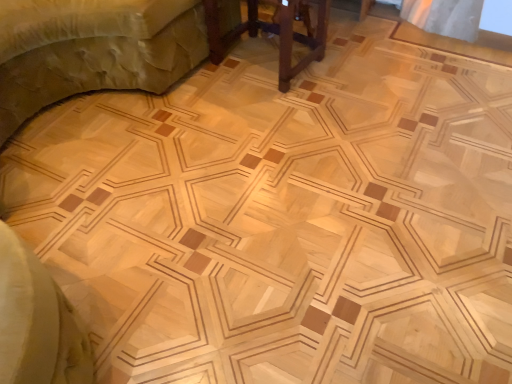
Question: In which direction should I rotate to look at brown wooden table at center, which ranks as the first furniture in right-to-left order?

Choices:
 (A) left
 (B) right

Answer: (B)

Question: Are wooden bed at upper left, arranged as the 1th furniture when viewed from the left, and brown wooden table at center, which ranks as the first furniture in right-to-left order, beside each other?

Choices:
 (A) yes
 (B) no

Answer: (B)

Question: From the image's perspective, is wooden bed at upper left, the second furniture positioned from the right, on brown wooden table at center, which ranks as the first furniture in right-to-left order?

Choices:
 (A) yes
 (B) no

Answer: (A)

Question: Is wooden bed at upper left, the second furniture positioned from the right, positioned before brown wooden table at center, the second furniture when ordered from left to right?

Choices:
 (A) no
 (B) yes

Answer: (B)

Question: Can you confirm if wooden bed at upper left, arranged as the 1th furniture when viewed from the left, is wider than brown wooden table at center, which ranks as the first furniture in right-to-left order?

Choices:
 (A) no
 (B) yes

Answer: (B)

Question: Is wooden bed at upper left, arranged as the 1th furniture when viewed from the left, smaller than brown wooden table at center, the second furniture when ordered from left to right?

Choices:
 (A) no
 (B) yes

Answer: (A)

Question: From a real-world perspective, is wooden bed at upper left, arranged as the 1th furniture when viewed from the left, under brown wooden table at center, which ranks as the first furniture in right-to-left order?

Choices:
 (A) yes
 (B) no

Answer: (B)

Question: Does brown wooden table at center, which ranks as the first furniture in right-to-left order, have a lesser width compared to wooden bed at upper left, arranged as the 1th furniture when viewed from the left?

Choices:
 (A) yes
 (B) no

Answer: (A)

Question: Can you confirm if brown wooden table at center, the second furniture when ordered from left to right, is taller than wooden bed at upper left, arranged as the 1th furniture when viewed from the left?

Choices:
 (A) no
 (B) yes

Answer: (A)

Question: Would you say brown wooden table at center, which ranks as the first furniture in right-to-left order, is a long distance from wooden bed at upper left, arranged as the 1th furniture when viewed from the left?

Choices:
 (A) no
 (B) yes

Answer: (A)

Question: From a real-world perspective, is brown wooden table at center, which ranks as the first furniture in right-to-left order, located beneath wooden bed at upper left, arranged as the 1th furniture when viewed from the left?

Choices:
 (A) yes
 (B) no

Answer: (A)

Question: Is brown wooden table at center, which ranks as the first furniture in right-to-left order, positioned with its back to wooden bed at upper left, arranged as the 1th furniture when viewed from the left?

Choices:
 (A) yes
 (B) no

Answer: (B)

Question: From a real-world perspective, does brown wooden table at center, the second furniture when ordered from left to right, stand above wooden bed at upper left, arranged as the 1th furniture when viewed from the left?

Choices:
 (A) yes
 (B) no

Answer: (B)

Question: Considering the positions of point (254, 6) and point (137, 46), is point (254, 6) closer or farther from the camera than point (137, 46)?

Choices:
 (A) farther
 (B) closer

Answer: (A)